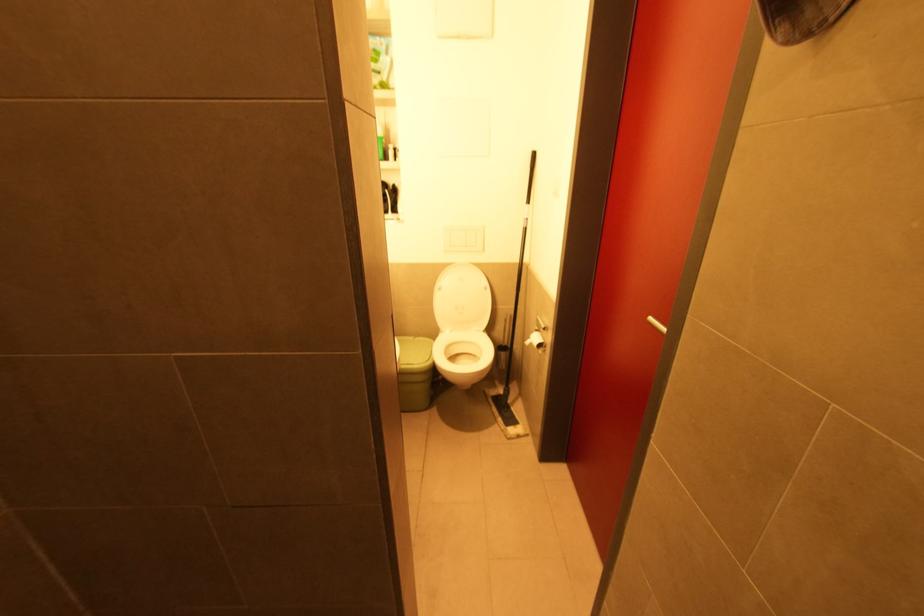
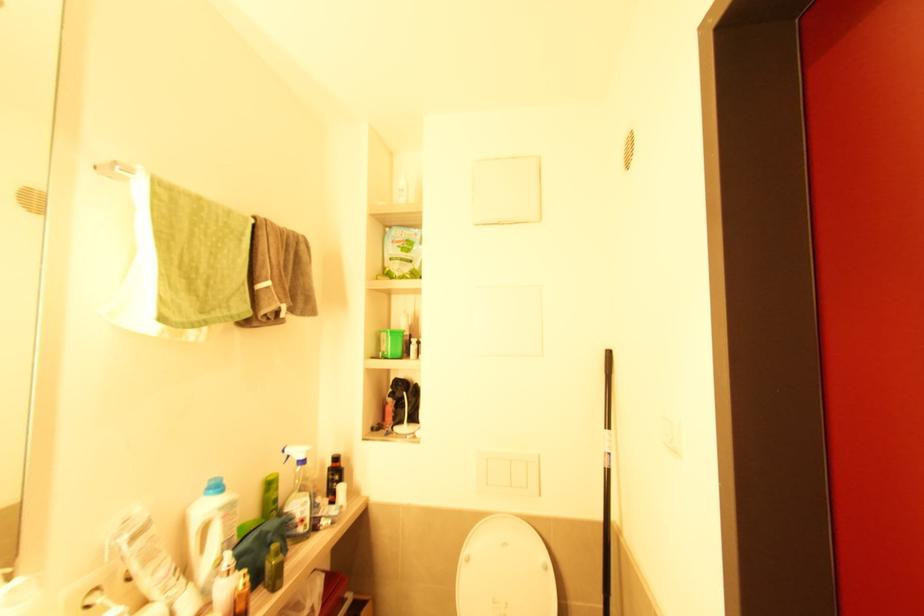
Find the pixel in the second image that matches the point at 526,230 in the first image.

(610, 472)